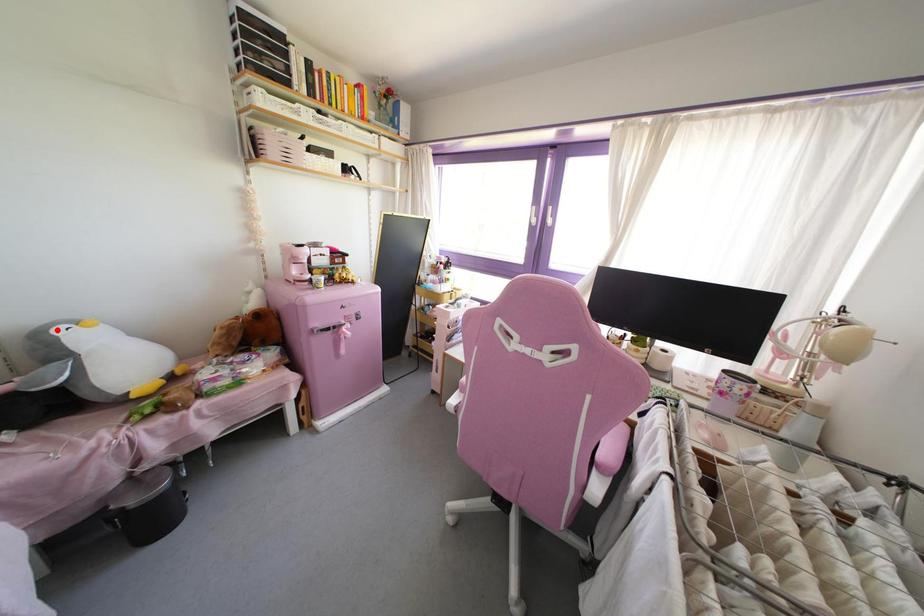
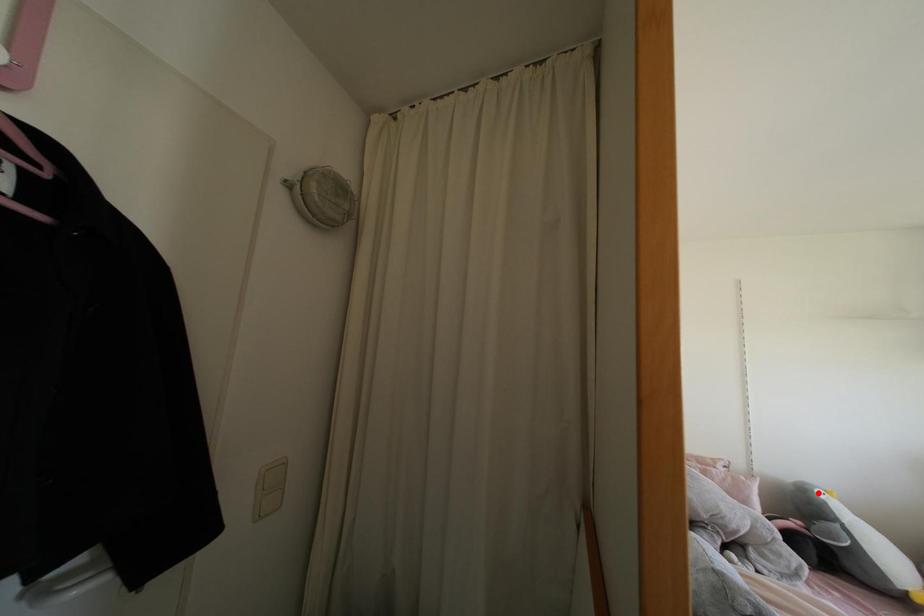
I am providing you with two images of the same scene from different viewpoints. A red point is marked on the first image and another point is marked on the second image. Does the point marked in image1 correspond to the same location as the one in image2?

Yes